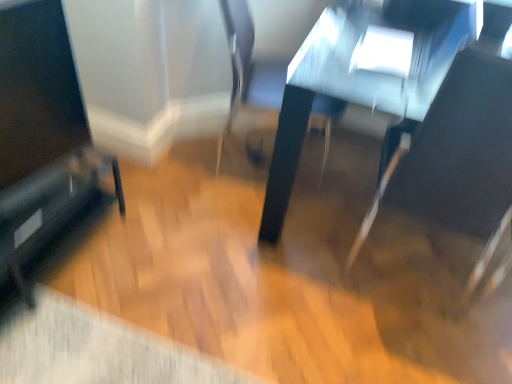
The image size is (512, 384). Describe the element at coordinates (458, 165) in the screenshot. I see `black leather swivel chair at right, arranged as the second swivel chair when viewed from the left` at that location.

The image size is (512, 384). Describe the element at coordinates (250, 81) in the screenshot. I see `metallic silver swivel chair at center, which ranks as the second swivel chair in right-to-left order` at that location.

I want to click on black leather swivel chair at right, arranged as the second swivel chair when viewed from the left, so click(x=458, y=165).

Can you tell me how much black leather swivel chair at right, arranged as the second swivel chair when viewed from the left, and metallic silver swivel chair at center, which ranks as the second swivel chair in right-to-left order, differ in facing direction?

77.3 degrees.

Is black leather swivel chair at right, which is counted as the 1th swivel chair, starting from the right, shorter than metallic silver swivel chair at center, which appears as the first swivel chair when viewed from the left?

No, black leather swivel chair at right, which is counted as the 1th swivel chair, starting from the right, is not shorter than metallic silver swivel chair at center, which appears as the first swivel chair when viewed from the left.

Is black leather swivel chair at right, which is counted as the 1th swivel chair, starting from the right, not inside metallic silver swivel chair at center, which ranks as the second swivel chair in right-to-left order?

Yes, black leather swivel chair at right, which is counted as the 1th swivel chair, starting from the right, is not within metallic silver swivel chair at center, which ranks as the second swivel chair in right-to-left order.

Considering the sizes of black leather swivel chair at right, which is counted as the 1th swivel chair, starting from the right, and metallic silver swivel chair at center, which ranks as the second swivel chair in right-to-left order, in the image, is black leather swivel chair at right, which is counted as the 1th swivel chair, starting from the right, bigger or smaller than metallic silver swivel chair at center, which ranks as the second swivel chair in right-to-left order,?

Considering their sizes, black leather swivel chair at right, which is counted as the 1th swivel chair, starting from the right, takes up more space than metallic silver swivel chair at center, which ranks as the second swivel chair in right-to-left order.

Which object is wider, metallic silver swivel chair at center, which appears as the first swivel chair when viewed from the left, or black glossy screen at left?

metallic silver swivel chair at center, which appears as the first swivel chair when viewed from the left, is wider.

Would you say metallic silver swivel chair at center, which appears as the first swivel chair when viewed from the left, is to the left or to the right of black glossy screen at left in the picture?

metallic silver swivel chair at center, which appears as the first swivel chair when viewed from the left, is positioned on black glossy screen at left's right side.

Considering the sizes of metallic silver swivel chair at center, which appears as the first swivel chair when viewed from the left, and black glossy screen at left in the image, is metallic silver swivel chair at center, which appears as the first swivel chair when viewed from the left, bigger or smaller than black glossy screen at left?

metallic silver swivel chair at center, which appears as the first swivel chair when viewed from the left, is bigger than black glossy screen at left.

Is metallic silver swivel chair at center, which ranks as the second swivel chair in right-to-left order, aimed at black glossy screen at left?

No, metallic silver swivel chair at center, which ranks as the second swivel chair in right-to-left order, is not turned towards black glossy screen at left.

Can you confirm if black glossy speaker at lower left is taller than metallic silver swivel chair at center, which ranks as the second swivel chair in right-to-left order?

No, black glossy speaker at lower left is not taller than metallic silver swivel chair at center, which ranks as the second swivel chair in right-to-left order.

Are black glossy speaker at lower left and metallic silver swivel chair at center, which ranks as the second swivel chair in right-to-left order, making contact?

black glossy speaker at lower left is not next to metallic silver swivel chair at center, which ranks as the second swivel chair in right-to-left order, and they're not touching.

Is black glossy speaker at lower left bigger or smaller than metallic silver swivel chair at center, which ranks as the second swivel chair in right-to-left order?

Considering their sizes, black glossy speaker at lower left takes up less space than metallic silver swivel chair at center, which ranks as the second swivel chair in right-to-left order.

Considering the positions of objects black glossy speaker at lower left and metallic silver swivel chair at center, which ranks as the second swivel chair in right-to-left order, in the image provided, who is more to the left, black glossy speaker at lower left or metallic silver swivel chair at center, which ranks as the second swivel chair in right-to-left order,?

black glossy speaker at lower left.

What's the angular difference between black leather swivel chair at right, arranged as the second swivel chair when viewed from the left, and black glossy speaker at lower left's facing directions?

They differ by 92 degrees in their facing directions.

Between black leather swivel chair at right, which is counted as the 1th swivel chair, starting from the right, and black glossy speaker at lower left, which one has more height?

black leather swivel chair at right, which is counted as the 1th swivel chair, starting from the right.

Considering the points (449, 218) and (45, 26), which point is in front, point (449, 218) or point (45, 26)?

Positioned in front is point (45, 26).

From a real-world perspective, relative to shiny black table at center, is black leather swivel chair at right, which is counted as the 1th swivel chair, starting from the right, vertically above or below?

In terms of real-world spatial position, black leather swivel chair at right, which is counted as the 1th swivel chair, starting from the right, is above shiny black table at center.

From the image's perspective, is black leather swivel chair at right, which is counted as the 1th swivel chair, starting from the right, above or below shiny black table at center?

Based on their image positions, black leather swivel chair at right, which is counted as the 1th swivel chair, starting from the right, is located beneath shiny black table at center.

Considering their positions, is black leather swivel chair at right, which is counted as the 1th swivel chair, starting from the right, located in front of or behind shiny black table at center?

In the image, black leather swivel chair at right, which is counted as the 1th swivel chair, starting from the right, appears in front of shiny black table at center.

What's the angular difference between black leather swivel chair at right, which is counted as the 1th swivel chair, starting from the right, and shiny black table at center's facing directions?

The facing directions of black leather swivel chair at right, which is counted as the 1th swivel chair, starting from the right, and shiny black table at center are 180 degrees apart.

Consider the image. What's the angular difference between black leather swivel chair at right, which is counted as the 1th swivel chair, starting from the right, and black glossy screen at left's facing directions?

The angle between the facing direction of black leather swivel chair at right, which is counted as the 1th swivel chair, starting from the right, and the facing direction of black glossy screen at left is 106 degrees.

Considering the relative sizes of black leather swivel chair at right, which is counted as the 1th swivel chair, starting from the right, and black glossy screen at left in the image provided, is black leather swivel chair at right, which is counted as the 1th swivel chair, starting from the right, wider than black glossy screen at left?

Correct, the width of black leather swivel chair at right, which is counted as the 1th swivel chair, starting from the right, exceeds that of black glossy screen at left.

Is black leather swivel chair at right, arranged as the second swivel chair when viewed from the left, facing away from black glossy screen at left?

black leather swivel chair at right, arranged as the second swivel chair when viewed from the left, does not have its back to black glossy screen at left.

From the picture: Is black leather swivel chair at right, which is counted as the 1th swivel chair, starting from the right, closer to camera compared to black glossy screen at left?

Yes.

Is metallic silver swivel chair at center, which appears as the first swivel chair when viewed from the left, taller than shiny black table at center?

Yes, metallic silver swivel chair at center, which appears as the first swivel chair when viewed from the left, is taller than shiny black table at center.

Considering the sizes of metallic silver swivel chair at center, which ranks as the second swivel chair in right-to-left order, and shiny black table at center in the image, is metallic silver swivel chair at center, which ranks as the second swivel chair in right-to-left order, bigger or smaller than shiny black table at center?

Clearly, metallic silver swivel chair at center, which ranks as the second swivel chair in right-to-left order, is smaller in size than shiny black table at center.

From the image's perspective, is metallic silver swivel chair at center, which ranks as the second swivel chair in right-to-left order, below shiny black table at center?

Actually, metallic silver swivel chair at center, which ranks as the second swivel chair in right-to-left order, appears above shiny black table at center in the image.

At what (x,y) coordinates should I click in order to perform the action: click on swivel chair to the left of black leather swivel chair at right, which is counted as the 1th swivel chair, starting from the right. Please return your answer as a coordinate pair (x, y). The image size is (512, 384). Looking at the image, I should click on (250, 81).

Which swivel chair is the 1st one when counting from the right side of the black glossy screen at left? Please provide its 2D coordinates.

[(250, 81)]

Consider the image. When comparing their distances from metallic silver swivel chair at center, which ranks as the second swivel chair in right-to-left order, does black glossy screen at left or shiny black table at center seem closer?

shiny black table at center.

Looking at this image, looking at the image, which one is located closer to black leather swivel chair at right, arranged as the second swivel chair when viewed from the left, metallic silver swivel chair at center, which appears as the first swivel chair when viewed from the left, or shiny black table at center?

Based on the image, shiny black table at center appears to be nearer to black leather swivel chair at right, arranged as the second swivel chair when viewed from the left.

Considering their positions, is black glossy screen at left positioned further to metallic silver swivel chair at center, which ranks as the second swivel chair in right-to-left order, than black leather swivel chair at right, which is counted as the 1th swivel chair, starting from the right?

black glossy screen at left.

Which object lies nearer to the anchor point shiny black table at center, black glossy speaker at lower left or black leather swivel chair at right, which is counted as the 1th swivel chair, starting from the right?

The object closer to shiny black table at center is black leather swivel chair at right, which is counted as the 1th swivel chair, starting from the right.

Which object lies further to the anchor point shiny black table at center, black leather swivel chair at right, arranged as the second swivel chair when viewed from the left, or black glossy screen at left?

black glossy screen at left.

Considering their positions, is black glossy speaker at lower left positioned closer to black glossy screen at left than shiny black table at center?

black glossy speaker at lower left is positioned closer to the anchor black glossy screen at left.

Which object lies further to the anchor point black glossy screen at left, black leather swivel chair at right, arranged as the second swivel chair when viewed from the left, or shiny black table at center?

black leather swivel chair at right, arranged as the second swivel chair when viewed from the left.

Which object lies further to the anchor point shiny black table at center, black glossy speaker at lower left or black glossy screen at left?

The object further to shiny black table at center is black glossy speaker at lower left.

Where is `swivel chair located between black glossy speaker at lower left and black leather swivel chair at right, which is counted as the 1th swivel chair, starting from the right, in the left-right direction`? swivel chair located between black glossy speaker at lower left and black leather swivel chair at right, which is counted as the 1th swivel chair, starting from the right, in the left-right direction is located at coordinates (250, 81).

Find the location of `swivel chair located between black glossy screen at left and black leather swivel chair at right, which is counted as the 1th swivel chair, starting from the right, in the left-right direction`. swivel chair located between black glossy screen at left and black leather swivel chair at right, which is counted as the 1th swivel chair, starting from the right, in the left-right direction is located at coordinates (250, 81).

What are the coordinates of `screen between black glossy speaker at lower left and shiny black table at center in the horizontal direction` in the screenshot? It's located at (37, 89).

You are a GUI agent. You are given a task and a screenshot of the screen. Output one action in this format:
    pyautogui.click(x=<x>, y=<y>)
    Task: Click on the screen between black glossy speaker at lower left and metallic silver swivel chair at center, which ranks as the second swivel chair in right-to-left order, from left to right
    Image resolution: width=512 pixels, height=384 pixels.
    Given the screenshot: What is the action you would take?
    pyautogui.click(x=37, y=89)